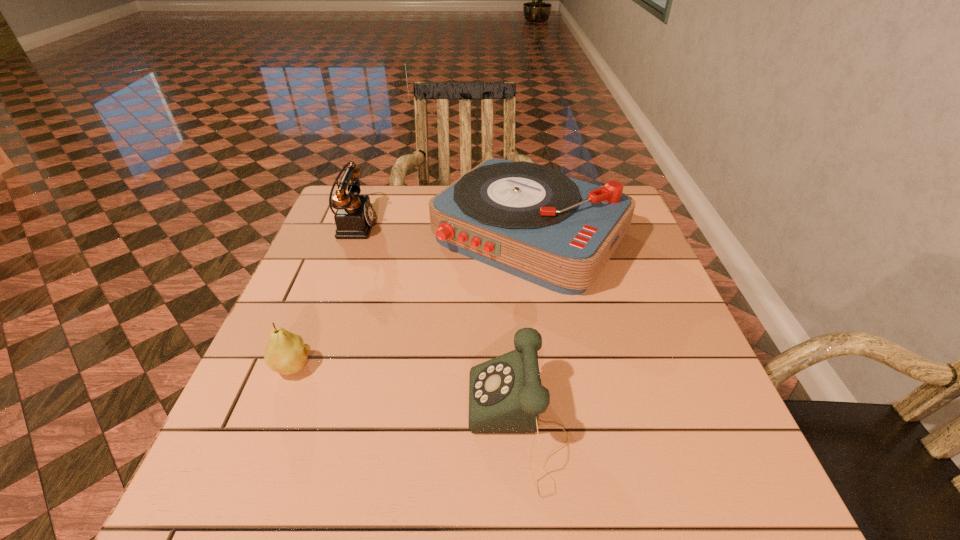
What are the coordinates of `the left telephone` in the screenshot? It's located at [x=354, y=218].

This screenshot has height=540, width=960. What are the coordinates of `the taller telephone` in the screenshot? It's located at (354, 218).

Locate an element on the screen. The width and height of the screenshot is (960, 540). record player is located at coordinates (529, 220).

Find the location of a particular element. The height and width of the screenshot is (540, 960). pear is located at coordinates (286, 353).

What are the coordinates of `the shorter telephone` in the screenshot? It's located at (505, 393).

Image resolution: width=960 pixels, height=540 pixels. In order to click on the nearer telephone in this screenshot , I will do `click(505, 393)`.

Where is `free region located 0.090m on the front of the left telephone at the rotary dial`? Image resolution: width=960 pixels, height=540 pixels. free region located 0.090m on the front of the left telephone at the rotary dial is located at coordinates (408, 225).

Where is `free space located on the left of the record player`? The image size is (960, 540). free space located on the left of the record player is located at coordinates (x=323, y=235).

The width and height of the screenshot is (960, 540). I want to click on vacant space located 0.280m on the right of the pear, so click(453, 367).

Locate an element on the screen. vacant space located on the dial of the shorter telephone is located at coordinates (350, 426).